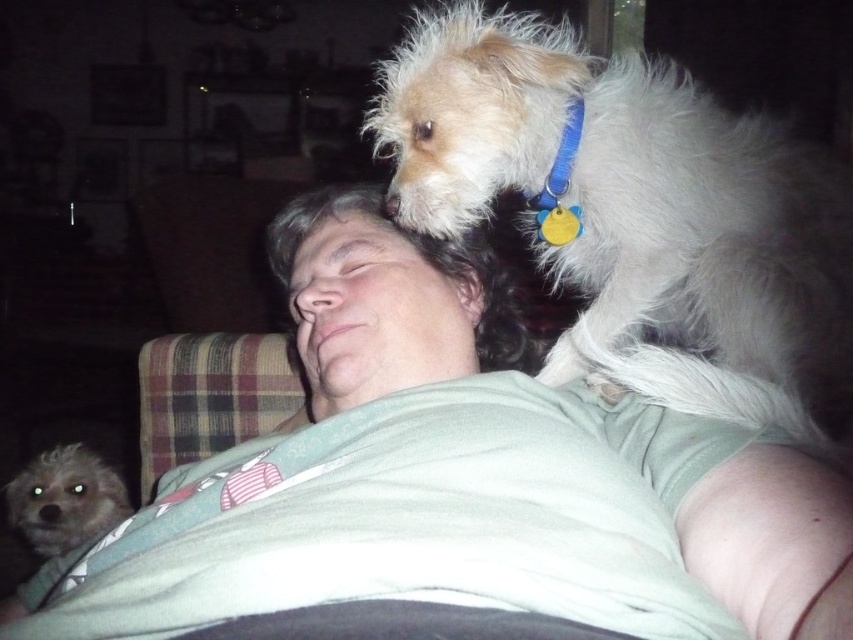
Question: In this image, where is white fluffy dog at upper center located relative to blue fabric neckband at upper center?

Choices:
 (A) right
 (B) left

Answer: (B)

Question: Which object appears closest to the camera in this image?

Choices:
 (A) blue fabric neckband at upper center
 (B) white fur dog at upper center
 (C) shaggy gray dog at lower left

Answer: (B)

Question: Can you confirm if white fur dog at upper center is positioned above blue fabric neckband at upper center?

Choices:
 (A) yes
 (B) no

Answer: (B)

Question: Does white fur dog at upper center appear on the left side of fluffy white dog at upper right?

Choices:
 (A) yes
 (B) no

Answer: (A)

Question: Based on their relative distances, which object is farther from the white fur dog at upper center?

Choices:
 (A) shaggy gray dog at lower left
 (B) blue fabric neckband at upper center
 (C) fluffy white dog at upper right

Answer: (A)

Question: Which of the following is the farthest from the observer?

Choices:
 (A) blue fabric neckband at upper center
 (B) white fluffy dog at upper center

Answer: (A)